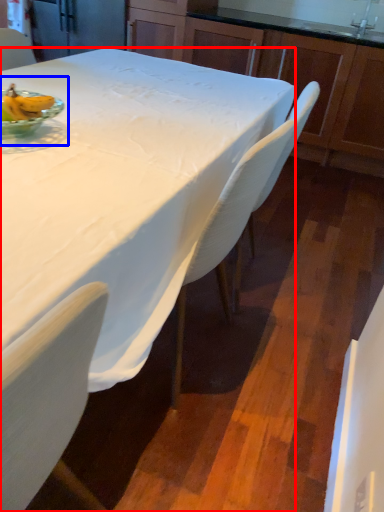
Question: Which object appears farthest to the camera in this image, desk (highlighted by a red box) or fruit dish (highlighted by a blue box)?

Choices:
 (A) desk
 (B) fruit dish

Answer: (B)